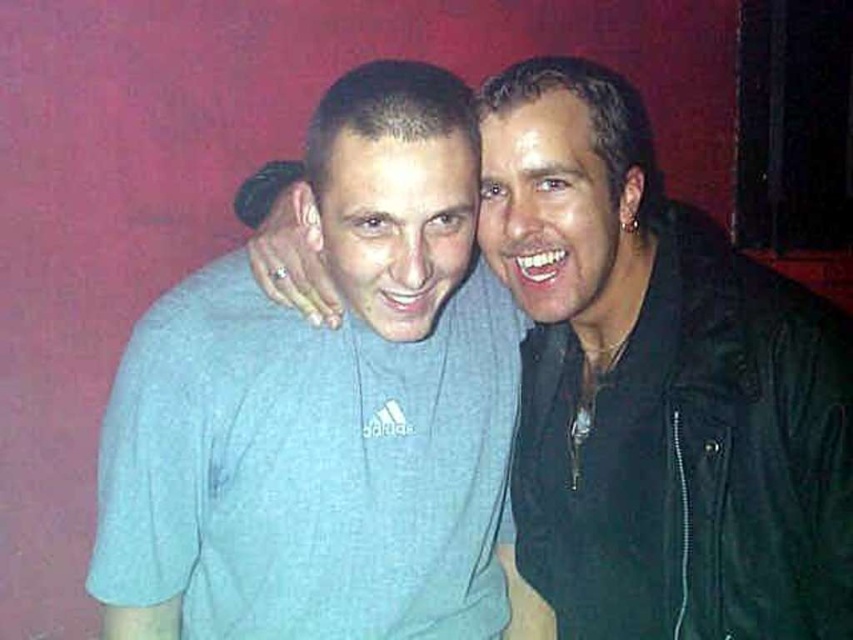
Between light blue cotton t-shirt at left and light blue cotton t-shirt at center, which one has more height?

light blue cotton t-shirt at left is taller.

Can you confirm if light blue cotton t-shirt at left is positioned above light blue cotton t-shirt at center?

Incorrect, light blue cotton t-shirt at left is not positioned above light blue cotton t-shirt at center.

Is point (318, 499) less distant than point (798, 490)?

That is False.

The height and width of the screenshot is (640, 853). I want to click on light blue cotton t-shirt at left, so click(325, 408).